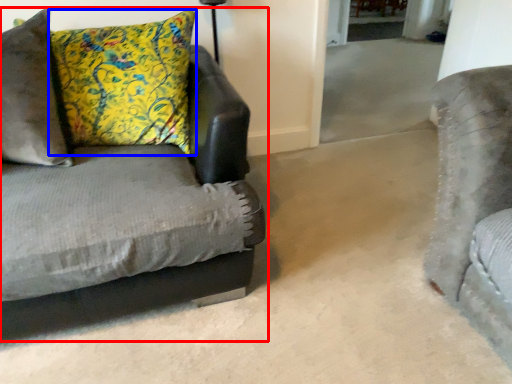
Question: Which point is closer to the camera, studio couch (highlighted by a red box) or pillow (highlighted by a blue box)?

Choices:
 (A) studio couch
 (B) pillow

Answer: (A)